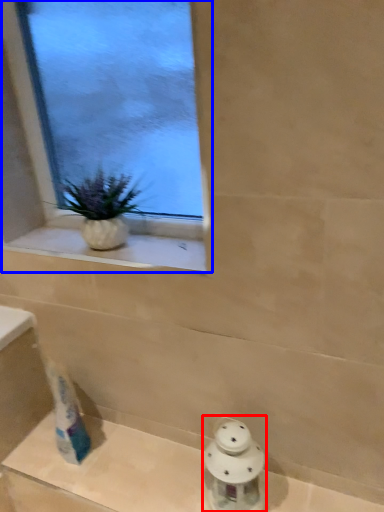
Question: Which object is closer to the camera taking this photo, porcelain (highlighted by a red box) or window (highlighted by a blue box)?

Choices:
 (A) porcelain
 (B) window

Answer: (B)